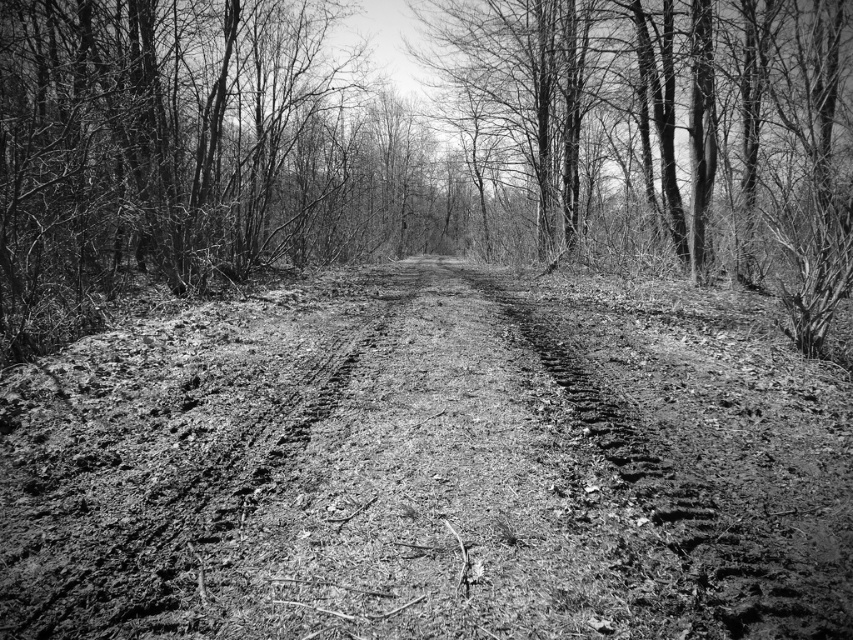
Question: Which point is farther to the camera?

Choices:
 (A) dirt track at center
 (B) smooth bark tree at center

Answer: (B)

Question: In this image, where is dirt track at center located relative to smooth bark tree at center?

Choices:
 (A) left
 (B) right

Answer: (A)

Question: Which point appears closest to the camera in this image?

Choices:
 (A) (468, 588)
 (B) (637, 112)

Answer: (A)

Question: Does dirt track at center have a larger size compared to smooth bark tree at center?

Choices:
 (A) no
 (B) yes

Answer: (A)

Question: Does dirt track at center have a larger size compared to smooth bark tree at center?

Choices:
 (A) yes
 (B) no

Answer: (B)